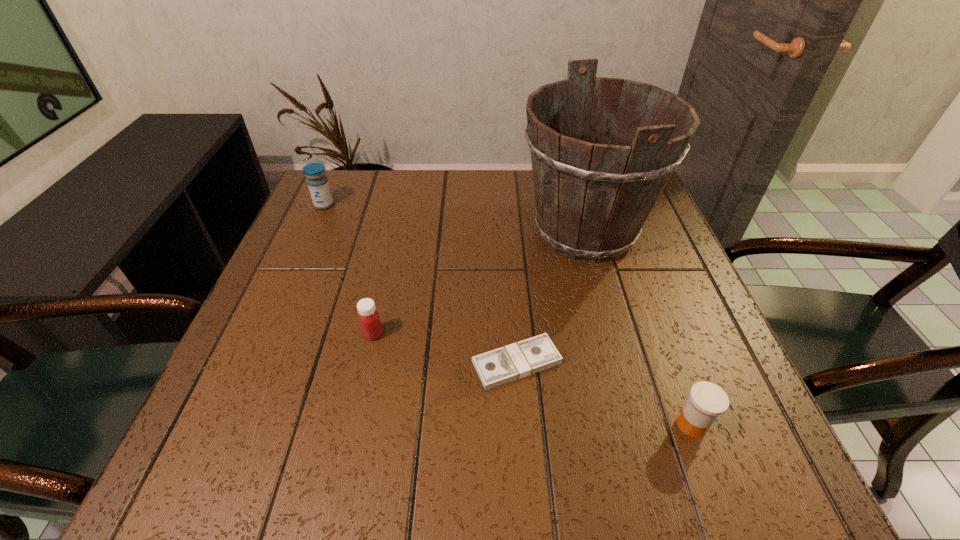
This screenshot has width=960, height=540. I want to click on object that stands as the closest to the dollar, so click(592, 199).

You are a GUI agent. You are given a task and a screenshot of the screen. Output one action in this format:
    pyautogui.click(x=<x>, y=<y>)
    Task: Click on the medicine identified as the closest to the shortest object
    
    Given the screenshot: What is the action you would take?
    pyautogui.click(x=707, y=401)

Locate an element on the screen. This screenshot has height=540, width=960. medicine that is the second closest to the farthest medicine is located at coordinates (707, 401).